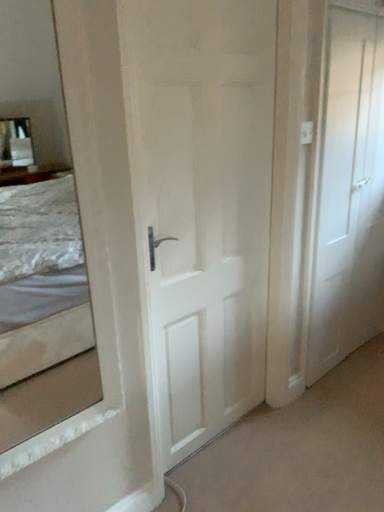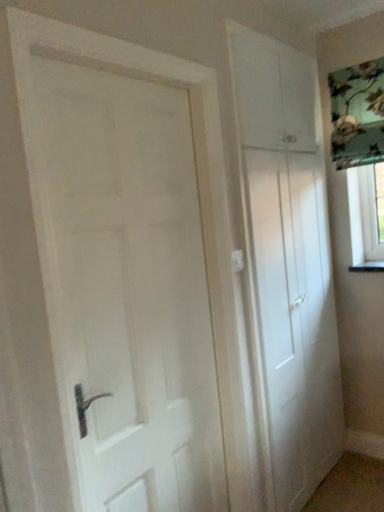
Question: How did the camera likely rotate when shooting the video?

Choices:
 (A) rotated left
 (B) rotated right

Answer: (B)